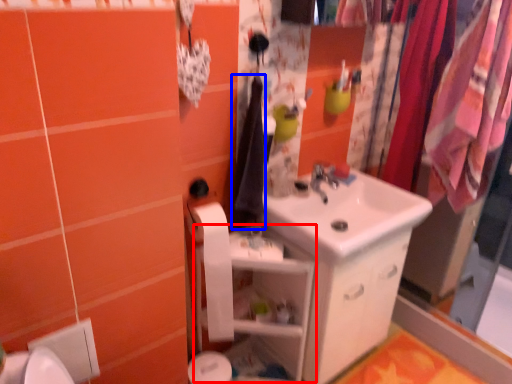
Question: Which object appears closest to the camera in this image, shelf (highlighted by a red box) or clothe (highlighted by a blue box)?

Choices:
 (A) shelf
 (B) clothe

Answer: (A)